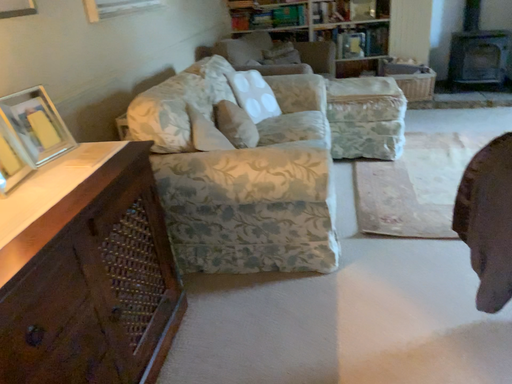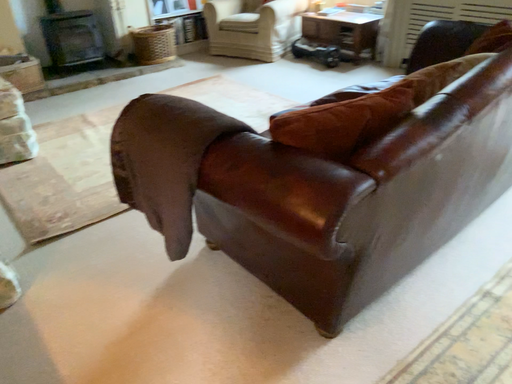
Question: Which way did the camera rotate in the video?

Choices:
 (A) rotated left
 (B) rotated right

Answer: (B)